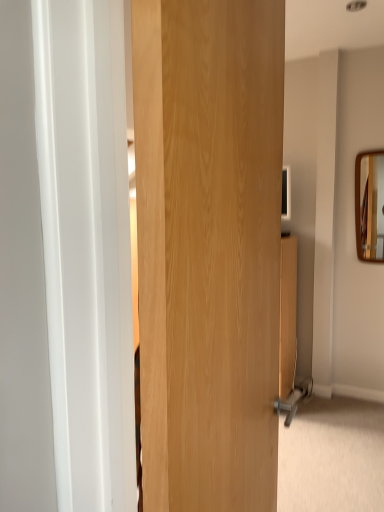
Question: In the image, is wooden door at center on the left side or the right side of wooden frame mirror at upper right?

Choices:
 (A) left
 (B) right

Answer: (A)

Question: In terms of size, does wooden door at center appear bigger or smaller than wooden frame mirror at upper right?

Choices:
 (A) big
 (B) small

Answer: (A)

Question: Considering the positions of wooden door at center and wooden frame mirror at upper right in the image, is wooden door at center taller or shorter than wooden frame mirror at upper right?

Choices:
 (A) tall
 (B) short

Answer: (A)

Question: From a real-world perspective, is wooden frame mirror at upper right physically located above or below wooden door at center?

Choices:
 (A) above
 (B) below

Answer: (A)

Question: Would you say wooden frame mirror at upper right is to the left or to the right of wooden door at center in the picture?

Choices:
 (A) left
 (B) right

Answer: (B)

Question: Is wooden frame mirror at upper right taller or shorter than wooden door at center?

Choices:
 (A) short
 (B) tall

Answer: (A)

Question: Considering their positions, is wooden frame mirror at upper right located in front of or behind wooden door at center?

Choices:
 (A) front
 (B) behind

Answer: (B)